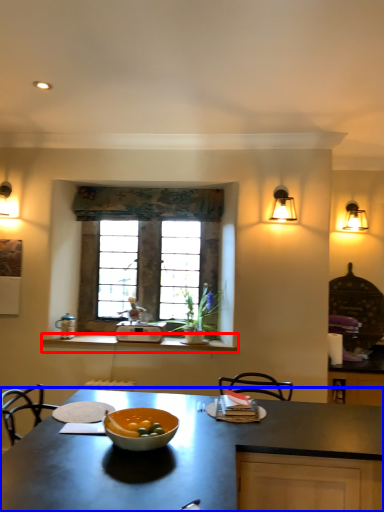
Question: Which of the following is the farthest to the observer, counter (highlighted by a red box) or countertop (highlighted by a blue box)?

Choices:
 (A) counter
 (B) countertop

Answer: (A)